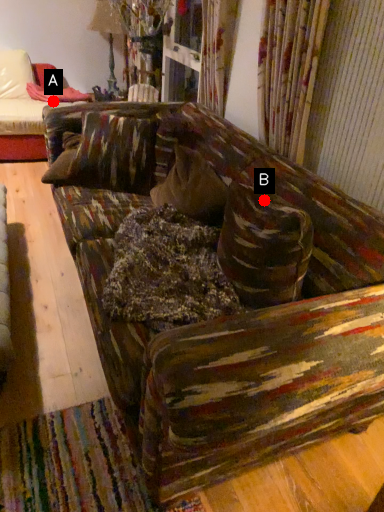
Question: Two points are circled on the image, labeled by A and B beside each circle. Which point is closer to the camera taking this photo?

Choices:
 (A) A is closer
 (B) B is closer

Answer: (B)